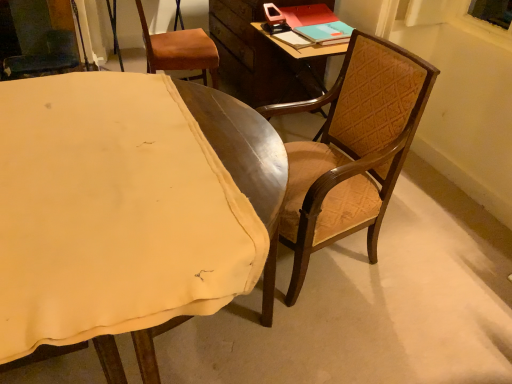
The width and height of the screenshot is (512, 384). In order to click on vacant point above teal matte book at upper right (from a real-world perspective) in this screenshot , I will do `click(324, 31)`.